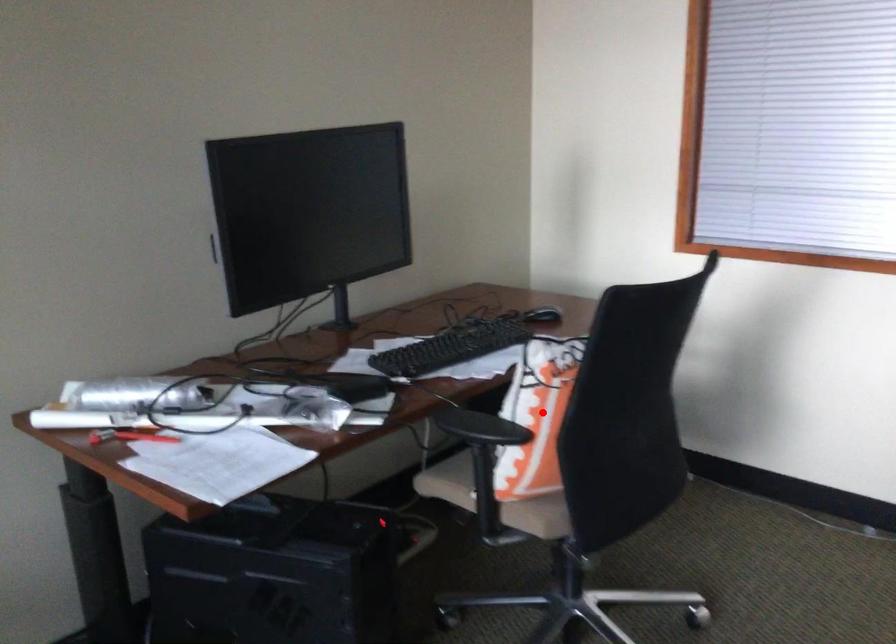
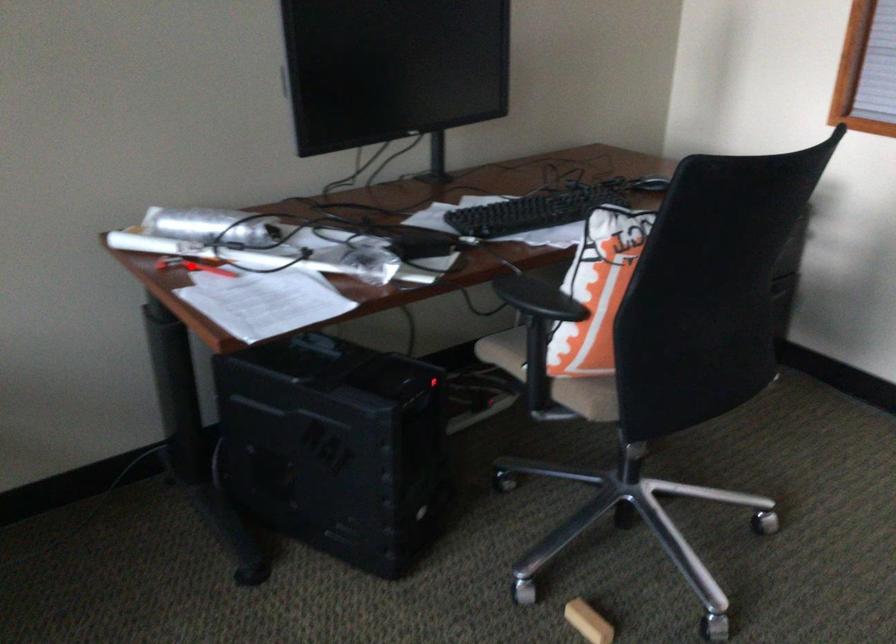
I am providing you with two images of the same scene from different viewpoints. A red point is marked on the first image and another point is marked on the second image. Do the highlighted points in image1 and image2 indicate the same real-world spot?

No